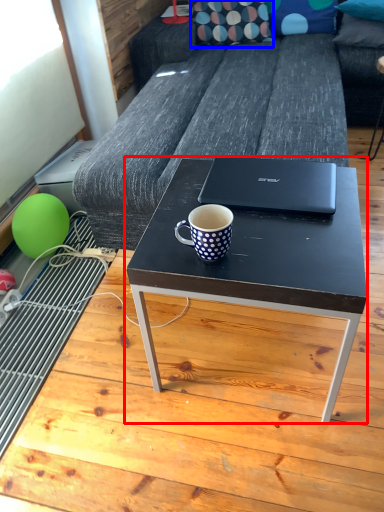
Question: Among these objects, which one is nearest to the camera, coffee table (highlighted by a red box) or pillow (highlighted by a blue box)?

Choices:
 (A) coffee table
 (B) pillow

Answer: (A)